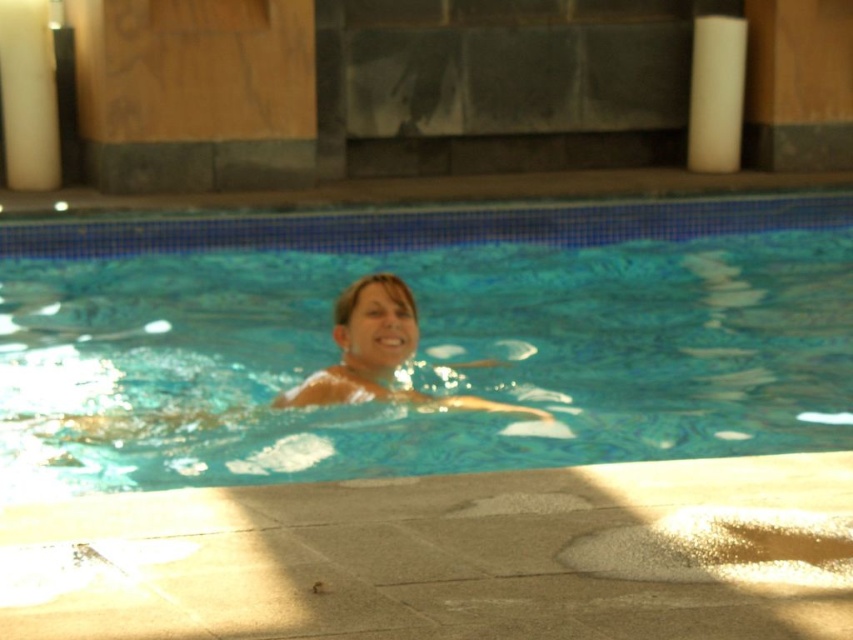
Which is below, clear blue water at center or smooth skin at center?

smooth skin at center is below.

Can you confirm if clear blue water at center is positioned to the right of smooth skin at center?

Correct, you'll find clear blue water at center to the right of smooth skin at center.

Does point (126, 348) lie in front of point (316, 404)?

No, it is not.

Image resolution: width=853 pixels, height=640 pixels. In order to click on clear blue water at center in this screenshot , I will do `click(426, 339)`.